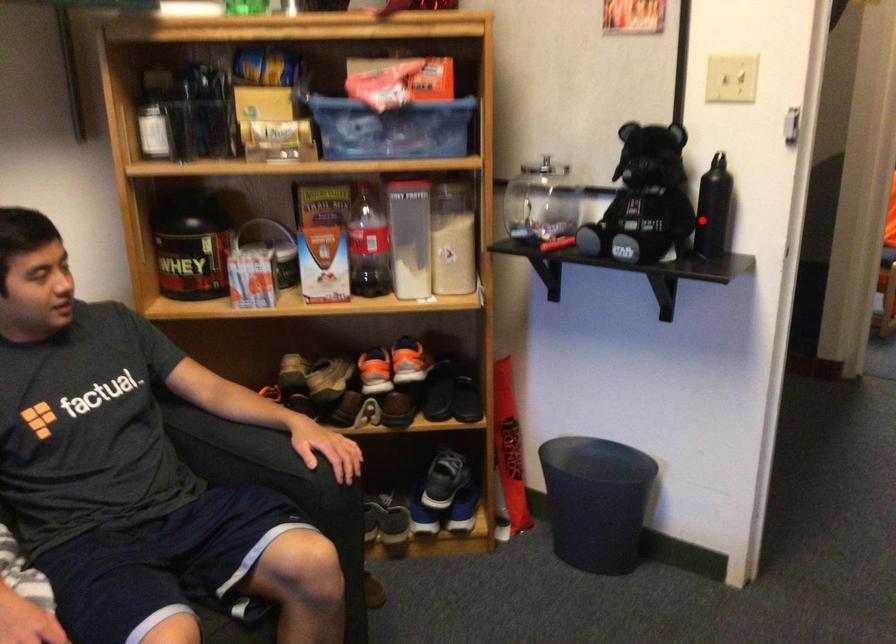
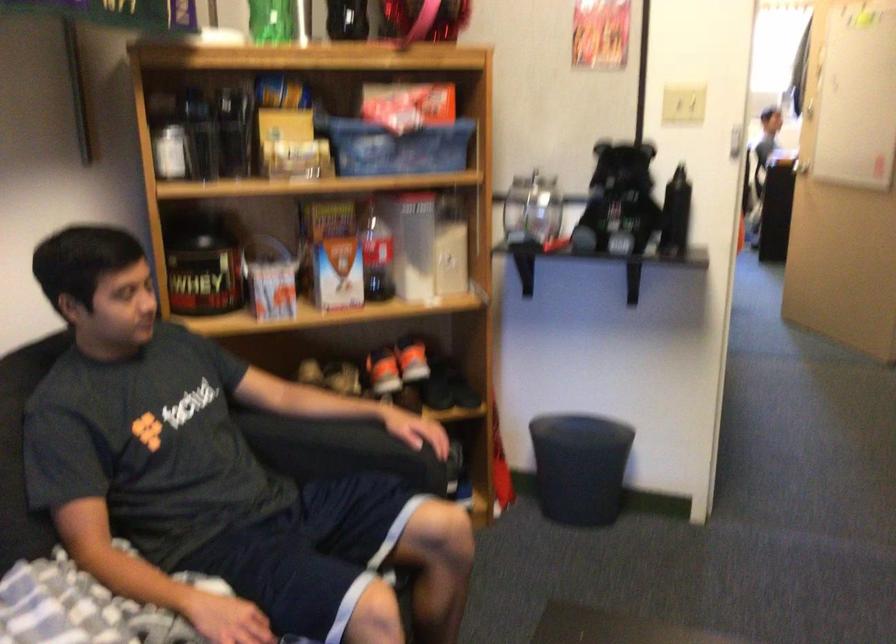
Question: I am providing you with two images of the same scene from different viewpoints. A red point is marked on the first image. Can you still see the location of the red point in image 2?

Choices:
 (A) Yes
 (B) No

Answer: (A)